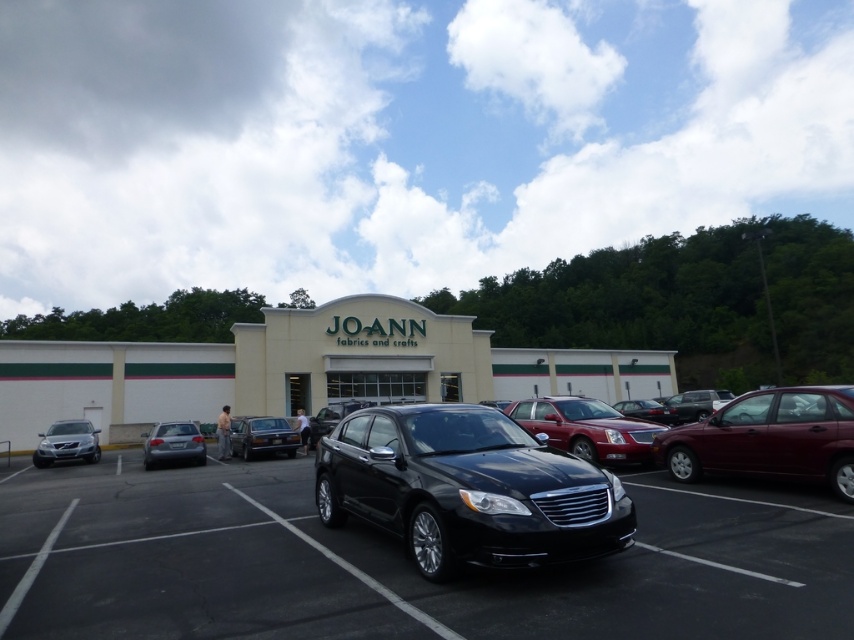
You are trying to parallel park your car, which is the same size as the satin silver sedan at left, into a space currently occupied by the black car at center. Based on the scene, will your car fit in that space?

The black car at center is wider than the satin silver sedan at left, so the space currently occupied by the black car at center may be too narrow for your car if it is the same size as the satin silver sedan at left. You should check the space dimensions carefully before attempting to park.

You are standing at the entrance of the Joann Fabrics and Crafts store and want to park your car in the nearest available parking spot. The parking lot has a grid layout with coordinates from 0 to 1 in both x and y directions. The entrance is located at coordinate point 0.5, 0.5. Can you determine if the black car at center is parked closer to the entrance than the other cars?

The black car at center is parked at coordinate point (396, 563). To determine its distance from the entrance at (427, 320), we calculate the Euclidean distance using the formula sqrt?x2?x1?2?y2?y1?2?. Plugging in the values, the distance is sqrt?0.881?0.5?2?0.466?0.5?2? which equals approximately 0.42 units. Since other cars are not mentioned in the description, we cannot compare their distances. Therefore, we cannot confirm if the black car at center is closer to the entrance than the other cars.